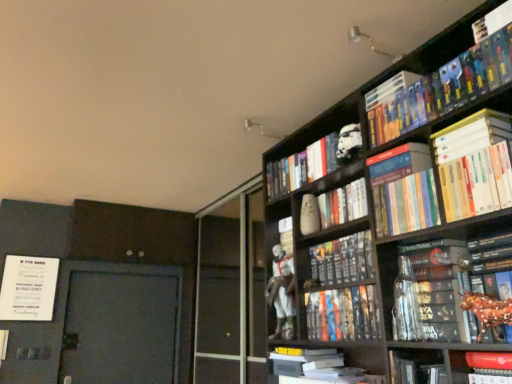
Where is `white matte book at lower center, acting as the 12th book starting from the top`? Image resolution: width=512 pixels, height=384 pixels. white matte book at lower center, acting as the 12th book starting from the top is located at coordinates (318, 367).

I want to click on hardcover book at center, which is the 7th book from top to bottom, so click(343, 259).

The image size is (512, 384). What do you see at coordinates (343, 259) in the screenshot?
I see `hardcover book at center, which is the 7th book from top to bottom` at bounding box center [343, 259].

Locate an element on the screen. white matte stormtrooper helmet at upper center, which is the first toy in top-to-bottom order is located at coordinates (349, 143).

At what (x,y) coordinates should I click in order to perform the action: click on hardcover book at center, marked as the tenth book in a top-to-bottom arrangement. Please return your answer as a coordinate pair (x, y). Looking at the image, I should click on (342, 314).

Where is `white matte book at lower center, acting as the 12th book starting from the top`? white matte book at lower center, acting as the 12th book starting from the top is located at coordinates (318, 367).

Measure the distance between matte white figure at center and hardcover book at upper right, which appears as the 12th book when ordered from the bottom.

The distance of matte white figure at center from hardcover book at upper right, which appears as the 12th book when ordered from the bottom, is 37.73 inches.

Considering the points (292, 326) and (400, 79), which point is behind, point (292, 326) or point (400, 79)?

The point (292, 326) is farther.

Is matte white figure at center aimed at hardcover book at upper right, which appears as the 1th book when viewed from the top?

No, matte white figure at center does not turn towards hardcover book at upper right, which appears as the 1th book when viewed from the top.

Can we say matte white figure at center lies outside hardcover book at upper right, which appears as the 12th book when ordered from the bottom?

Yes.

Is white matte book at upper right, the 10th book in the bottom-to-top sequence, located outside white matte stormtrooper helmet at upper center, which is counted as the second toy, starting from the bottom?

Absolutely, white matte book at upper right, the 10th book in the bottom-to-top sequence, is external to white matte stormtrooper helmet at upper center, which is counted as the second toy, starting from the bottom.

From a real-world perspective, which is physically above, white matte book at upper right, which is the third book from top to bottom, or white matte stormtrooper helmet at upper center, the second toy in the left-to-right sequence?

white matte stormtrooper helmet at upper center, the second toy in the left-to-right sequence, is physically above.

Can you tell me how much white matte book at upper right, which is the third book from top to bottom, and white matte stormtrooper helmet at upper center, which is the first toy in top-to-bottom order, differ in facing direction?

white matte book at upper right, which is the third book from top to bottom, and white matte stormtrooper helmet at upper center, which is the first toy in top-to-bottom order, are facing 15.7 degrees away from each other.

How far apart are white matte book at upper right, the 10th book in the bottom-to-top sequence, and white matte stormtrooper helmet at upper center, which is the first toy in top-to-bottom order?

A distance of 20.40 inches exists between white matte book at upper right, the 10th book in the bottom-to-top sequence, and white matte stormtrooper helmet at upper center, which is the first toy in top-to-bottom order.

Is hardcover book at center, positioned as the sixth book in top-to-bottom order, facing towards shiny metallic horse at right, placed as the fifth book when sorted from bottom to top?

No, hardcover book at center, positioned as the sixth book in top-to-bottom order, does not turn towards shiny metallic horse at right, placed as the fifth book when sorted from bottom to top.

From the image's perspective, is hardcover book at center, positioned as the seventh book in bottom-to-top order, located beneath shiny metallic horse at right, which ranks as the 8th book in top-to-bottom order?

Actually, hardcover book at center, positioned as the seventh book in bottom-to-top order, appears above shiny metallic horse at right, which ranks as the 8th book in top-to-bottom order, in the image.

How many degrees apart are the facing directions of hardcover book at center, positioned as the sixth book in top-to-bottom order, and shiny metallic horse at right, which ranks as the 8th book in top-to-bottom order?

The facing directions of hardcover book at center, positioned as the sixth book in top-to-bottom order, and shiny metallic horse at right, which ranks as the 8th book in top-to-bottom order, are 1.88 degrees apart.

Are white glossy statue at center and rubberized red toy at lower right, which is counted as the 4th book, starting from the bottom, making contact?

No.

From the image's perspective, is white glossy statue at center beneath rubberized red toy at lower right, which is counted as the 4th book, starting from the bottom?

Yes.

Considering the relative positions of white glossy statue at center and rubberized red toy at lower right, which appears as the 9th book when viewed from the top, in the image provided, is white glossy statue at center in front of rubberized red toy at lower right, which appears as the 9th book when viewed from the top,?

No, white glossy statue at center is further to the viewer.

Which is more to the left, white glossy statue at center or rubberized red toy at lower right, which appears as the 9th book when viewed from the top?

white glossy statue at center is more to the left.

From the image's perspective, relative to white matte helmet at upper center, arranged as the 4th book when viewed from the top, is hardcover book at center, the eleventh book in the top-to-bottom sequence, above or below?

hardcover book at center, the eleventh book in the top-to-bottom sequence, is below white matte helmet at upper center, arranged as the 4th book when viewed from the top.

Is hardcover book at center, positioned as the 2th book in bottom-to-top order, oriented towards white matte helmet at upper center, arranged as the 4th book when viewed from the top?

No.

Locate an element on the screen. the 7th book below when counting from the white matte helmet at upper center, arranged as the 4th book when viewed from the top (from the image's perspective) is located at coordinates (417, 367).

From their relative heights in the image, would you say hardcover book at center, positioned as the 2th book in bottom-to-top order, is taller or shorter than white matte helmet at upper center, arranged as the 4th book when viewed from the top?

Clearly, hardcover book at center, positioned as the 2th book in bottom-to-top order, is taller compared to white matte helmet at upper center, arranged as the 4th book when viewed from the top.

From the image's perspective, relative to shiny metallic horse at right, which ranks as the 8th book in top-to-bottom order, is hardcover book at upper right, which appears as the 1th book when viewed from the top, above or below?

Based on their image positions, hardcover book at upper right, which appears as the 1th book when viewed from the top, is located above shiny metallic horse at right, which ranks as the 8th book in top-to-bottom order.

Which object is positioned more to the right, hardcover book at upper right, which appears as the 12th book when ordered from the bottom, or shiny metallic horse at right, which ranks as the 8th book in top-to-bottom order?

From the viewer's perspective, shiny metallic horse at right, which ranks as the 8th book in top-to-bottom order, appears more on the right side.

Are hardcover book at upper right, which appears as the 1th book when viewed from the top, and shiny metallic horse at right, placed as the fifth book when sorted from bottom to top, far apart?

That's not correct — hardcover book at upper right, which appears as the 1th book when viewed from the top, is a little close to shiny metallic horse at right, placed as the fifth book when sorted from bottom to top.

Measure the distance from hardcover book at upper right, which appears as the 1th book when viewed from the top, to shiny metallic horse at right, which ranks as the 8th book in top-to-bottom order.

hardcover book at upper right, which appears as the 1th book when viewed from the top, is 77.83 centimeters away from shiny metallic horse at right, which ranks as the 8th book in top-to-bottom order.

Is white matte book at upper right, the 10th book in the bottom-to-top sequence, inside hardcover books at upper right, which is the 11th book in bottom-to-top order?

That's incorrect, white matte book at upper right, the 10th book in the bottom-to-top sequence, is not inside hardcover books at upper right, which is the 11th book in bottom-to-top order.

Which object is closer to the camera taking this photo, hardcover books at upper right, which is the 11th book in bottom-to-top order, or white matte book at upper right, which is the third book from top to bottom?

hardcover books at upper right, which is the 11th book in bottom-to-top order, is more forward.

From the white matte book at upper right, which is the third book from top to bottom, count the 1st book to the left and point to it. Please provide its 2D coordinates.

[(445, 88)]

How many degrees apart are the facing directions of hardcover books at upper right, which is the 11th book in bottom-to-top order, and white matte book at upper right, the 10th book in the bottom-to-top sequence?

0.733 degrees separate the facing orientations of hardcover books at upper right, which is the 11th book in bottom-to-top order, and white matte book at upper right, the 10th book in the bottom-to-top sequence.

Which book is the 5th one when counting from the front of the matte white figure at center? Please provide its 2D coordinates.

[(390, 89)]

Locate an element on the screen. The image size is (512, 384). book that is the 1st one below the white matte stormtrooper helmet at upper center, the second toy in the left-to-right sequence (from a real-world perspective) is located at coordinates point(471,134).

Estimate the real-world distances between objects in this image. Which object is closer to matte white figure at center, hardcover books at upper right, which is the 2th book in top-to-bottom order, or hardcover book at center, the third book ordered from the bottom?

hardcover book at center, the third book ordered from the bottom, is positioned closer to the anchor matte white figure at center.

Estimate the real-world distances between objects in this image. Which object is further from shiny metallic horse at right, which ranks as the 8th book in top-to-bottom order, white glossy statue at center or white matte book at upper right, the 10th book in the bottom-to-top sequence?

Based on the image, white glossy statue at center appears to be further to shiny metallic horse at right, which ranks as the 8th book in top-to-bottom order.

Based on the photo, when comparing their distances from hardcover book at center, positioned as the 2th book in bottom-to-top order, does hardcover book at upper right, which appears as the 12th book when ordered from the bottom, or hardcover book at center, positioned as the sixth book in top-to-bottom order, seem closer?

hardcover book at center, positioned as the sixth book in top-to-bottom order, is positioned closer to the anchor hardcover book at center, positioned as the 2th book in bottom-to-top order.

Considering their positions, is white matte book at lower center, acting as the 12th book starting from the top, positioned closer to hardcover book at center, the eleventh book in the top-to-bottom sequence, than white matte book at upper right, the 10th book in the bottom-to-top sequence?

white matte book at lower center, acting as the 12th book starting from the top, is positioned closer to the anchor hardcover book at center, the eleventh book in the top-to-bottom sequence.

Looking at the image, which one is located closer to white matte book at lower center, acting as the 12th book starting from the top, matte white figure at center or white matte stormtrooper helmet at upper center, the second toy in the left-to-right sequence?

The object closer to white matte book at lower center, acting as the 12th book starting from the top, is matte white figure at center.

Looking at the image, which one is located further to white matte helmet at upper center, positioned as the ninth book in bottom-to-top order, hardcover book at center, which is the 7th book from top to bottom, or rubberized red toy at lower right, which appears as the 9th book when viewed from the top?

rubberized red toy at lower right, which appears as the 9th book when viewed from the top, lies further to white matte helmet at upper center, positioned as the ninth book in bottom-to-top order, than the other object.

Estimate the real-world distances between objects in this image. Which object is closer to hardcover books at upper right, which is the 2th book in top-to-bottom order, white matte vase at upper center, arranged as the second toy when viewed from the front, or white matte book at lower center, the 1th book from the bottom?

white matte vase at upper center, arranged as the second toy when viewed from the front, is closer to hardcover books at upper right, which is the 2th book in top-to-bottom order.

Which object lies further to the anchor point hardcover book at center, the 6th book from the bottom, rubberized red toy at lower right, which appears as the 9th book when viewed from the top, or white matte vase at upper center, arranged as the second toy when viewed from the front?

rubberized red toy at lower right, which appears as the 9th book when viewed from the top.

The width and height of the screenshot is (512, 384). In order to click on person that lies between white matte stormtrooper helmet at upper center, the 2th toy positioned from the back, and white matte book at lower center, acting as the 12th book starting from the top, from top to bottom in this screenshot , I will do click(x=282, y=291).

This screenshot has width=512, height=384. Find the location of `toy between white matte stormtrooper helmet at upper center, which is the first toy in top-to-bottom order, and hardcover book at center, the eleventh book in the top-to-bottom sequence, in the vertical direction`. toy between white matte stormtrooper helmet at upper center, which is the first toy in top-to-bottom order, and hardcover book at center, the eleventh book in the top-to-bottom sequence, in the vertical direction is located at coordinates (309, 215).

Find the location of a particular element. The height and width of the screenshot is (384, 512). person between white glossy statue at center and hardcover book at center, the 6th book from the bottom, in the horizontal direction is located at coordinates (282, 291).

Identify the location of screen door between white matte book at upper right, the 10th book in the bottom-to-top sequence, and white matte book at lower center, acting as the 12th book starting from the top, from top to bottom. (231, 289).